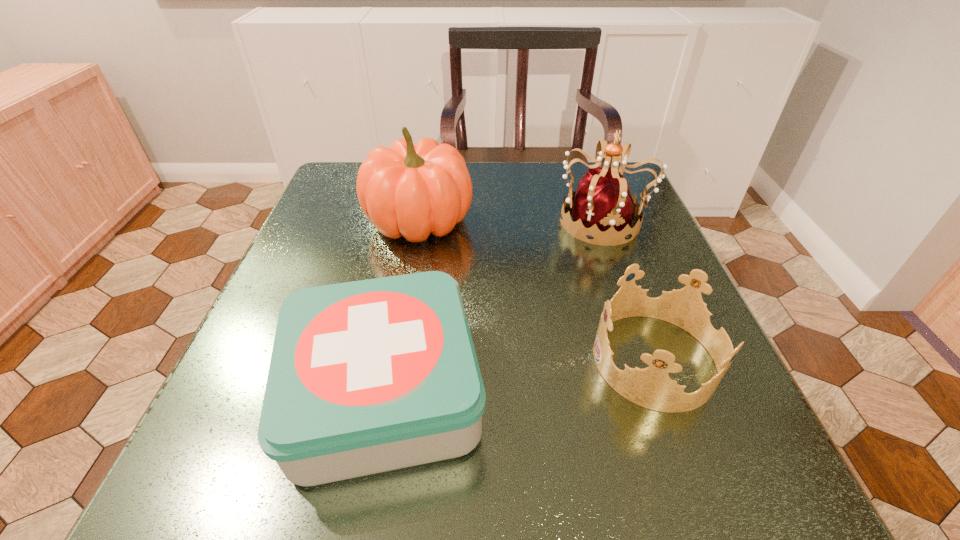
The height and width of the screenshot is (540, 960). I want to click on free region located on the front-facing side of the shorter tiara, so click(x=408, y=360).

Where is `vacant space located 0.220m on the right of the first-aid kit`? The image size is (960, 540). vacant space located 0.220m on the right of the first-aid kit is located at coordinates (636, 392).

Image resolution: width=960 pixels, height=540 pixels. I want to click on pumpkin at the far edge, so click(411, 191).

At what (x,y) coordinates should I click in order to perform the action: click on tiara positioned at the far edge. Please return your answer as a coordinate pair (x, y). This screenshot has width=960, height=540. Looking at the image, I should click on (603, 209).

The image size is (960, 540). Find the location of `object at the near edge`. object at the near edge is located at coordinates (369, 376).

Locate an element on the screen. pumpkin located at the left edge is located at coordinates (411, 191).

Where is `the first-aid kit at the left edge`? the first-aid kit at the left edge is located at coordinates (369, 376).

Where is `object that is at the far left corner`? object that is at the far left corner is located at coordinates (411, 191).

At what (x,y) coordinates should I click in order to perform the action: click on object that is at the near left corner. Please return your answer as a coordinate pair (x, y). The width and height of the screenshot is (960, 540). Looking at the image, I should click on point(369,376).

At what (x,y) coordinates should I click in order to perform the action: click on object that is at the far right corner. Please return your answer as a coordinate pair (x, y). This screenshot has height=540, width=960. Looking at the image, I should click on point(603,209).